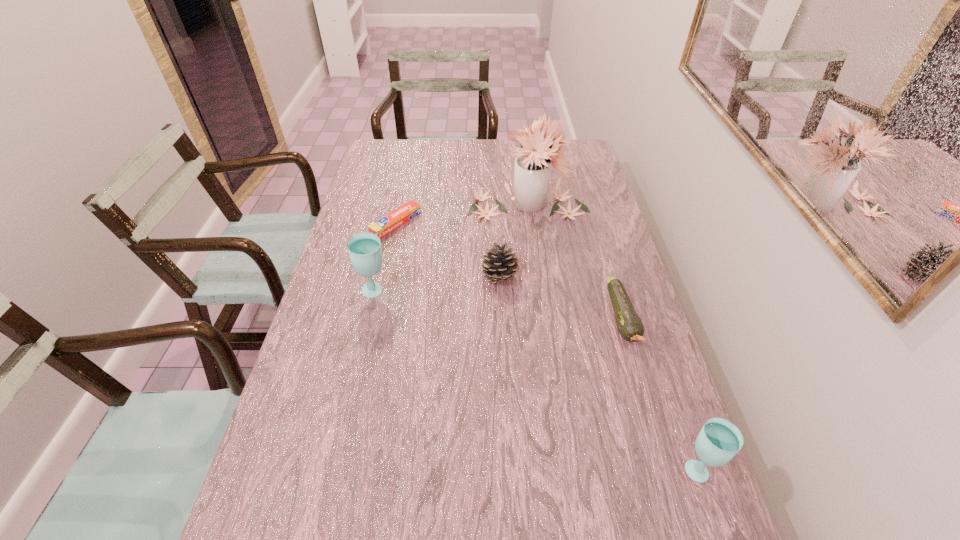
At what (x,y) coordinates should I click in order to perform the action: click on the taller glass. Please return your answer as a coordinate pair (x, y). Image resolution: width=960 pixels, height=540 pixels. Looking at the image, I should click on (364, 249).

The image size is (960, 540). In order to click on the fifth shortest object in this screenshot , I will do click(x=364, y=249).

In order to click on the nearest object in this screenshot , I will do `click(719, 441)`.

Where is `the nearer glass`? Image resolution: width=960 pixels, height=540 pixels. the nearer glass is located at coordinates (719, 441).

Locate an element on the screen. The width and height of the screenshot is (960, 540). bouquet is located at coordinates (532, 166).

Identify the location of the second shortest object. The width and height of the screenshot is (960, 540). (629, 324).

I want to click on toothpaste, so click(x=388, y=223).

Locate an element on the screen. This screenshot has height=540, width=960. pinecone is located at coordinates (499, 265).

Identify the location of vacant area situated on the right of the farther glass. Image resolution: width=960 pixels, height=540 pixels. (491, 292).

Identify the location of vacant space located on the left of the right glass. The image size is (960, 540). (600, 468).